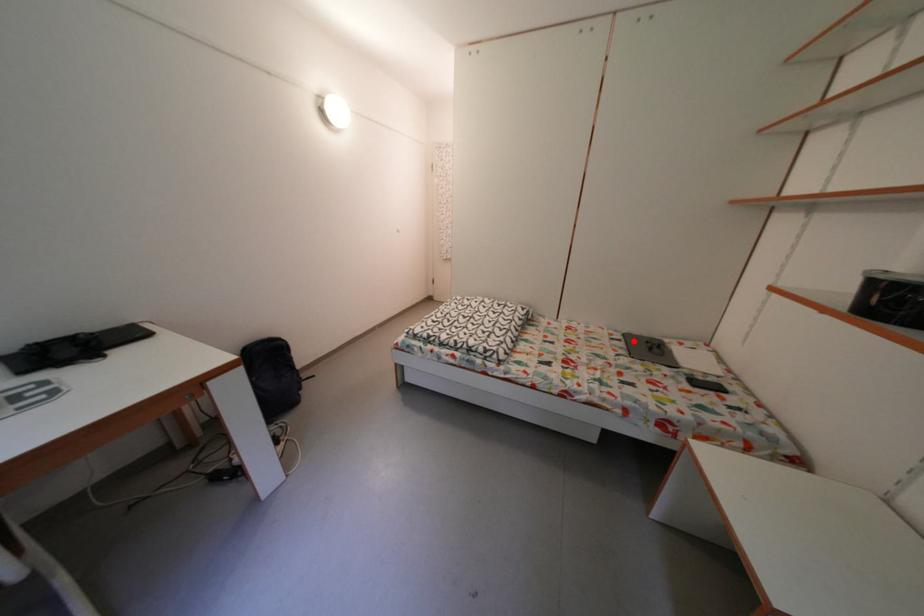
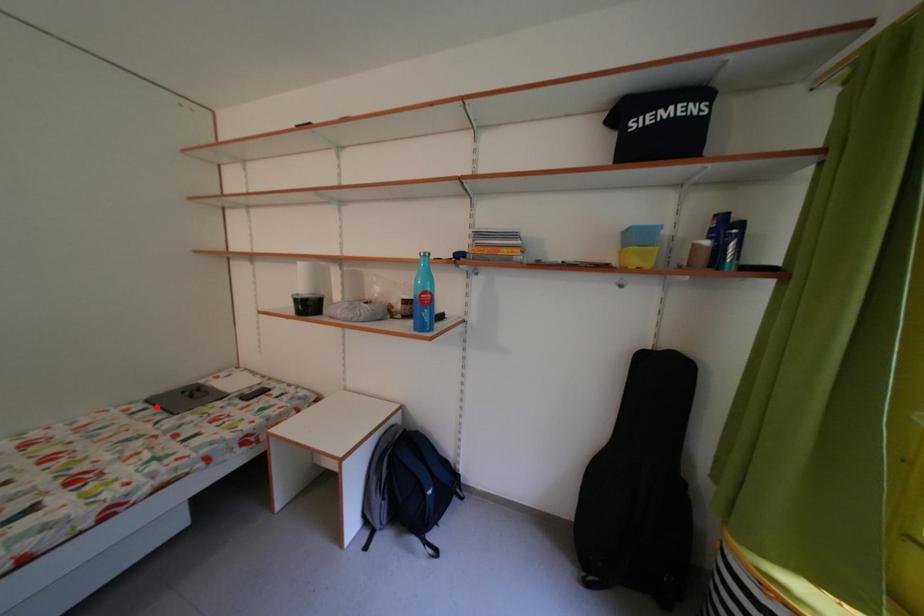
I am providing you with two images of the same scene from different viewpoints. A red point is marked on the first image and another point is marked on the second image. Is the marked point in image1 the same physical position as the marked point in image2?

Yes